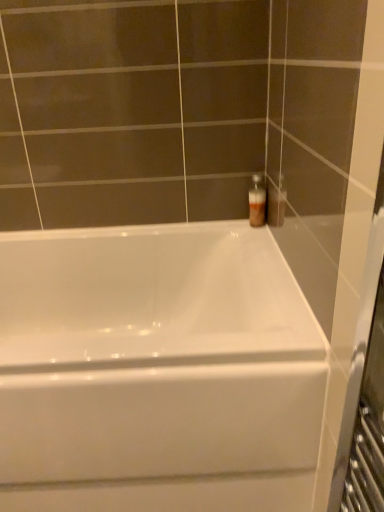
Locate an element on the screen. This screenshot has width=384, height=512. translucent plastic bottle at upper right is located at coordinates (257, 201).

Describe the element at coordinates (257, 201) in the screenshot. I see `translucent plastic bottle at upper right` at that location.

I want to click on white glossy bathtub at center, so click(x=156, y=371).

Measure the distance between white glossy bathtub at center and camera.

white glossy bathtub at center and camera are 31.98 inches apart from each other.

Describe the element at coordinates (156, 371) in the screenshot. I see `white glossy bathtub at center` at that location.

Locate an element on the screen. This screenshot has height=512, width=384. translucent plastic bottle at upper right is located at coordinates (257, 201).

Looking at this image, considering the positions of objects translucent plastic bottle at upper right and white glossy bathtub at center in the image provided, who is more to the left, translucent plastic bottle at upper right or white glossy bathtub at center?

Positioned to the left is white glossy bathtub at center.

Relative to white glossy bathtub at center, is translucent plastic bottle at upper right in front or behind?

Visually, translucent plastic bottle at upper right is located behind white glossy bathtub at center.

Is point (251, 194) closer or farther from the camera than point (25, 244)?

Point (251, 194) appears to be closer to the viewer than point (25, 244).

From the image's perspective, is translucent plastic bottle at upper right on top of white glossy bathtub at center?

Yes, from the image's perspective, translucent plastic bottle at upper right is above white glossy bathtub at center.

From a real-world perspective, is translucent plastic bottle at upper right positioned under white glossy bathtub at center based on gravity?

Actually, translucent plastic bottle at upper right is physically above white glossy bathtub at center in the real world.

Is translucent plastic bottle at upper right thinner than white glossy bathtub at center?

Indeed, translucent plastic bottle at upper right has a lesser width compared to white glossy bathtub at center.

Considering the relative sizes of translucent plastic bottle at upper right and white glossy bathtub at center in the image provided, is translucent plastic bottle at upper right shorter than white glossy bathtub at center?

Yes.

Which of these two, translucent plastic bottle at upper right or white glossy bathtub at center, is bigger?

With larger size is white glossy bathtub at center.

Would you say white glossy bathtub at center is part of translucent plastic bottle at upper right's contents?

No, white glossy bathtub at center is not inside translucent plastic bottle at upper right.

Would you consider translucent plastic bottle at upper right to be distant from white glossy bathtub at center?

No, there isn't a large distance between translucent plastic bottle at upper right and white glossy bathtub at center.

Is translucent plastic bottle at upper right facing away from white glossy bathtub at center?

No, translucent plastic bottle at upper right is not facing away from white glossy bathtub at center.

Identify the location of soap dispenser that appears on the right of white glossy bathtub at center. (257, 201).

In the scene shown: Does white glossy bathtub at center appear on the left side of translucent plastic bottle at upper right?

Yes.

Is the position of white glossy bathtub at center less distant than that of translucent plastic bottle at upper right?

Yes, white glossy bathtub at center is closer to the camera.

Does point (51, 375) come closer to viewer compared to point (255, 214)?

Yes.

From the image's perspective, does white glossy bathtub at center appear higher than translucent plastic bottle at upper right?

No, from the image's perspective, white glossy bathtub at center is not above translucent plastic bottle at upper right.

From a real-world perspective, is white glossy bathtub at center above or below translucent plastic bottle at upper right?

In terms of real-world spatial position, white glossy bathtub at center is below translucent plastic bottle at upper right.

Considering the sizes of objects white glossy bathtub at center and translucent plastic bottle at upper right in the image provided, who is wider, white glossy bathtub at center or translucent plastic bottle at upper right?

white glossy bathtub at center is wider.

Between white glossy bathtub at center and translucent plastic bottle at upper right, which one has less height?

Standing shorter between the two is translucent plastic bottle at upper right.

From the picture: Can you confirm if white glossy bathtub at center is bigger than translucent plastic bottle at upper right?

Indeed, white glossy bathtub at center has a larger size compared to translucent plastic bottle at upper right.

Is white glossy bathtub at center inside the boundaries of translucent plastic bottle at upper right, or outside?

white glossy bathtub at center is not enclosed by translucent plastic bottle at upper right.

Is white glossy bathtub at center positioned far away from translucent plastic bottle at upper right?

No, there isn't a large distance between white glossy bathtub at center and translucent plastic bottle at upper right.

Is white glossy bathtub at center oriented away from translucent plastic bottle at upper right?

No, white glossy bathtub at center is not facing the opposite direction of translucent plastic bottle at upper right.

What's the angular difference between white glossy bathtub at center and translucent plastic bottle at upper right's facing directions?

They differ by 0.00092 degrees in their facing directions.

This screenshot has width=384, height=512. In order to click on bathtub located in front of the translucent plastic bottle at upper right in this screenshot , I will do `click(156, 371)`.

Find the location of a particular element. bathtub in front of the translucent plastic bottle at upper right is located at coordinates (156, 371).

Identify the location of soap dispenser located behind the white glossy bathtub at center. (257, 201).